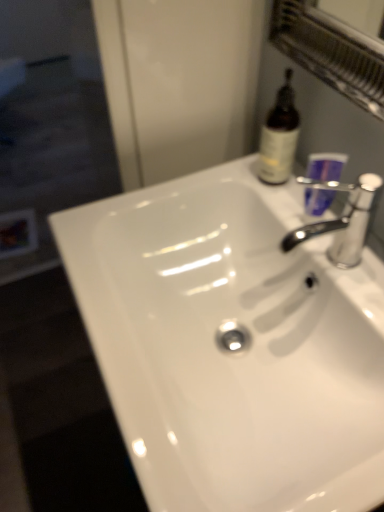
Identify the location of free space between purple plastic cup at upper right and brown glass bottle at upper right. (292, 196).